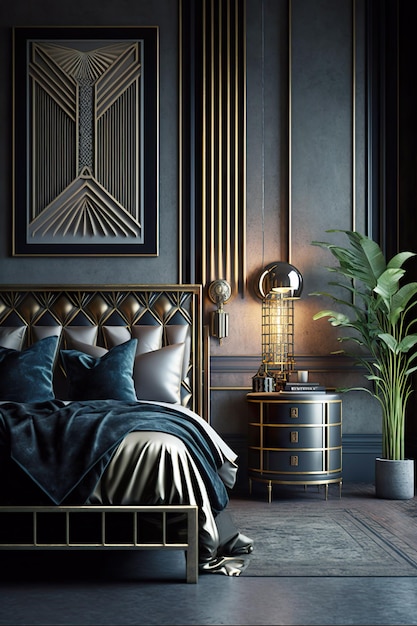
Locate an element on the screen. The width and height of the screenshot is (417, 626). footboard is located at coordinates (190, 546), (163, 539), (134, 531), (102, 529), (67, 536), (37, 541), (19, 510).